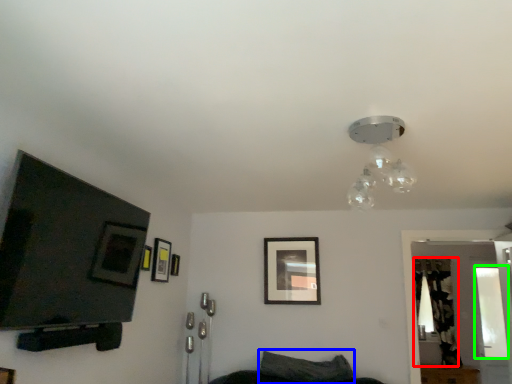
Question: Based on their relative distances, which object is nearer to curtain (highlighted by a red box)? Choose from pillow (highlighted by a blue box) and window (highlighted by a green box).

Choices:
 (A) pillow
 (B) window

Answer: (B)